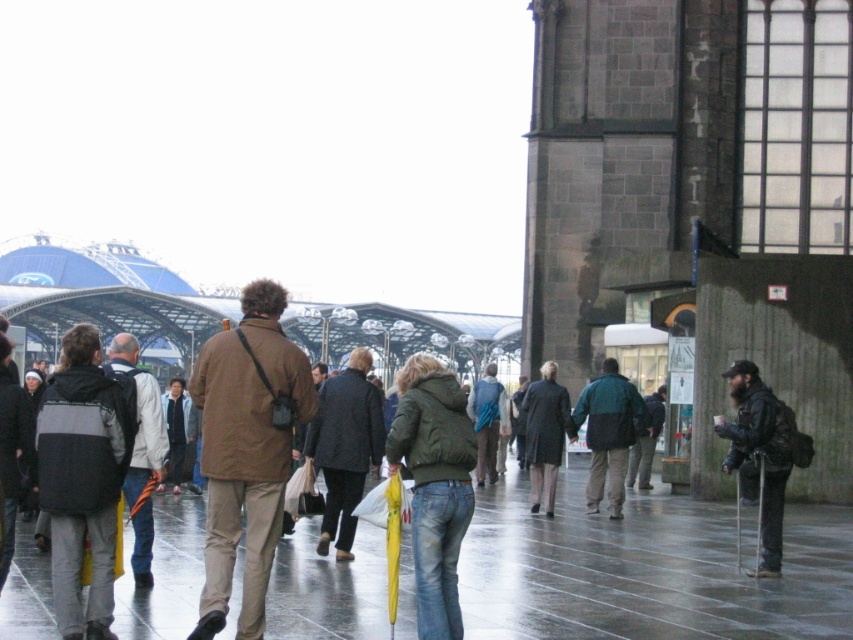
You are standing at the point labeled as point (247,451) in the image. Based on the scene description, what object is located at this point?

The point (247,451) is on the brown matte jacket at center.